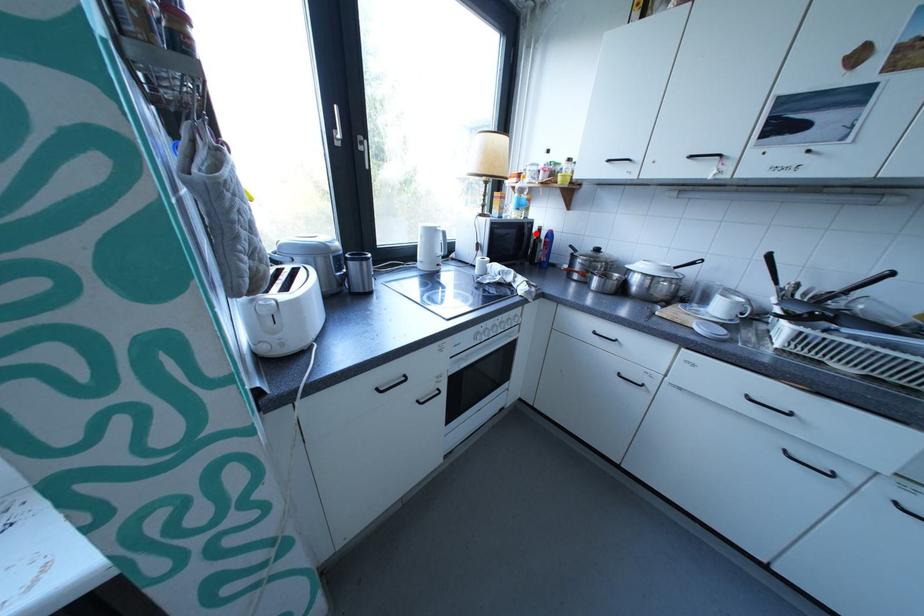
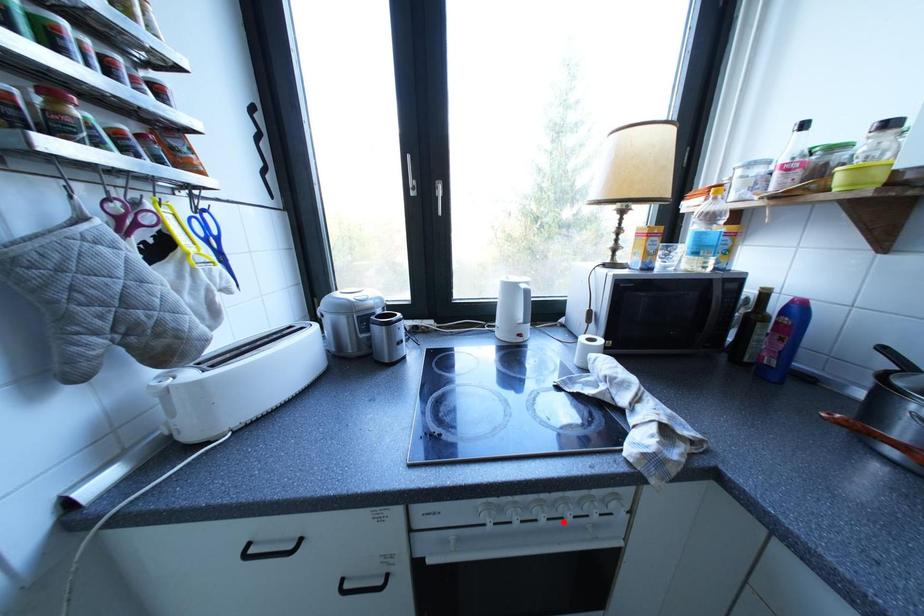
I am providing you with two images of the same scene from different viewpoints. A red point is marked on the first image and another point is marked on the second image. Are the points marked in image1 and image2 representing the same 3D position?

No